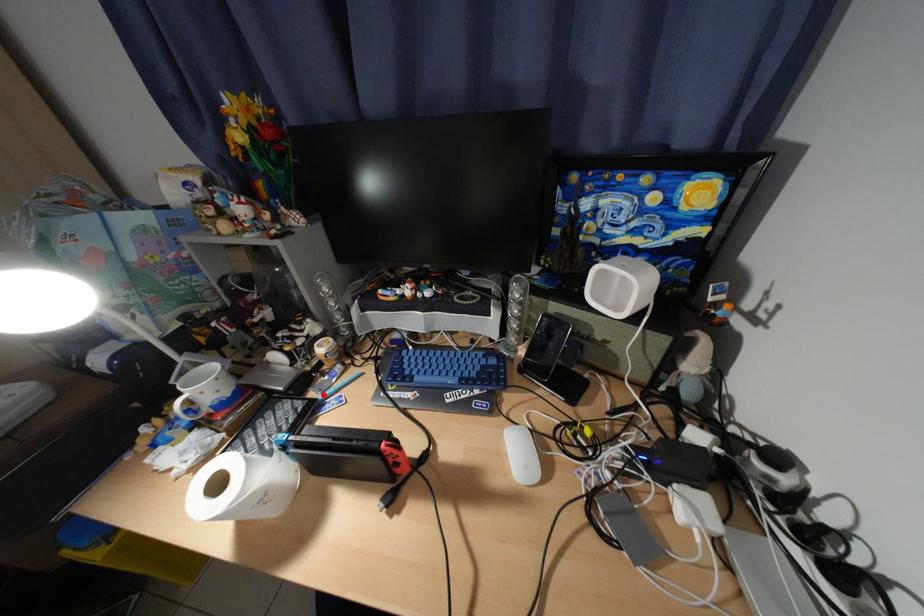
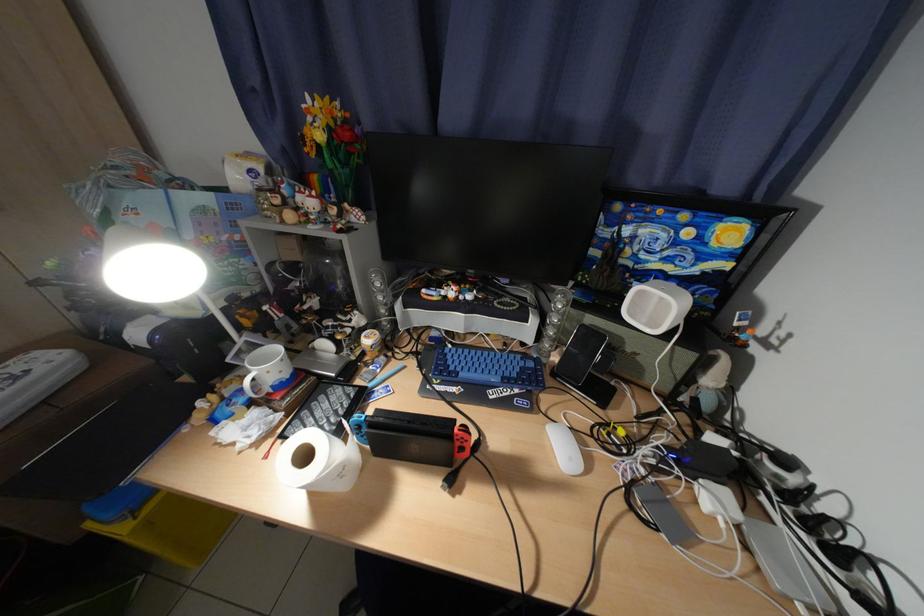
Locate, in the second image, the point that corresponds to the highlighted location in the first image.

(370, 383)